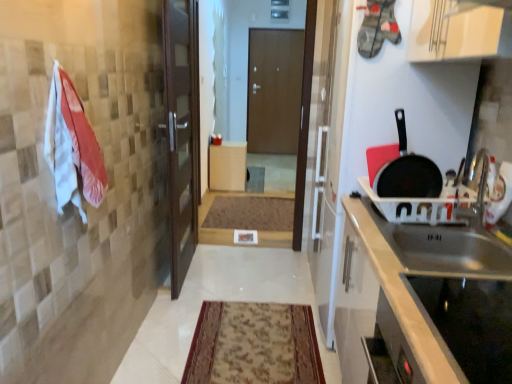
Question: Does black matte frying pan at right have a lesser height compared to brown carpet at center, which appears as the 2th mat when viewed from the front?

Choices:
 (A) yes
 (B) no

Answer: (B)

Question: From a real-world perspective, is black matte frying pan at right under brown carpet at center, which appears as the 2th mat when viewed from the front?

Choices:
 (A) yes
 (B) no

Answer: (B)

Question: From a real-world perspective, is black matte frying pan at right located higher than brown carpet at center, the 2th mat positioned from the bottom?

Choices:
 (A) no
 (B) yes

Answer: (B)

Question: Can you confirm if black matte frying pan at right is positioned to the right of brown carpet at center, the first mat positioned from the back?

Choices:
 (A) no
 (B) yes

Answer: (B)

Question: Can you confirm if black matte frying pan at right is wider than brown carpet at center, the first mat positioned from the back?

Choices:
 (A) yes
 (B) no

Answer: (B)

Question: Is black matte frying pan at right closer to the viewer compared to brown carpet at center, the first mat viewed from the top?

Choices:
 (A) yes
 (B) no

Answer: (A)

Question: From a real-world perspective, is white cotton towel at left below white matte cabinet at center?

Choices:
 (A) yes
 (B) no

Answer: (B)

Question: Is white cotton towel at left wider than white matte cabinet at center?

Choices:
 (A) yes
 (B) no

Answer: (B)

Question: Does white cotton towel at left have a lesser height compared to white matte cabinet at center?

Choices:
 (A) yes
 (B) no

Answer: (A)

Question: Is white cotton towel at left thinner than white matte cabinet at center?

Choices:
 (A) yes
 (B) no

Answer: (A)

Question: Is white cotton towel at left positioned before white matte cabinet at center?

Choices:
 (A) yes
 (B) no

Answer: (A)

Question: Is white matte cabinet at center located within white cotton towel at left?

Choices:
 (A) no
 (B) yes

Answer: (A)

Question: Considering the relative sizes of stainless steel sink at right and black glass cooktop at lower right in the image provided, is stainless steel sink at right wider than black glass cooktop at lower right?

Choices:
 (A) no
 (B) yes

Answer: (B)